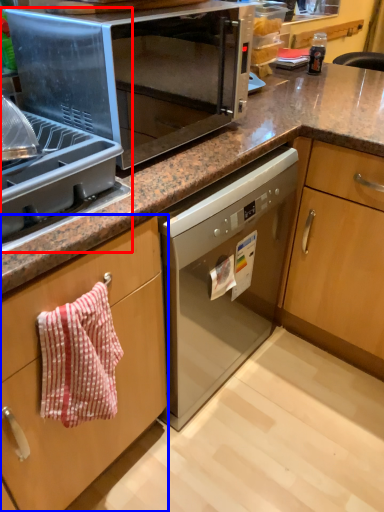
Question: Which point is further to the camera, appliance (highlighted by a red box) or cabinetry (highlighted by a blue box)?

Choices:
 (A) appliance
 (B) cabinetry

Answer: (B)